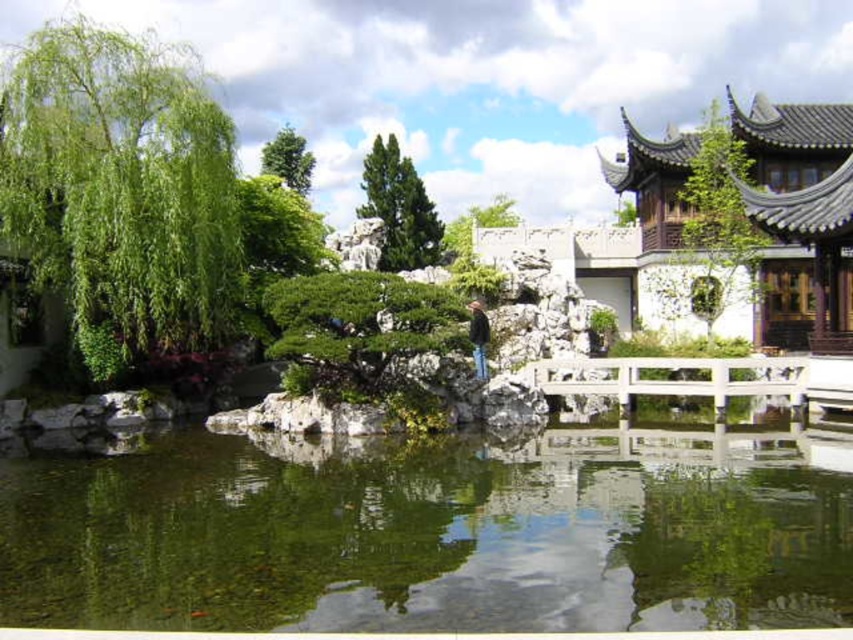
Who is shorter, green leafy tree at upper center or green leafy tree at center?

With less height is green leafy tree at upper center.

Who is more distant from viewer, (x=285, y=138) or (x=502, y=211)?

The point (x=285, y=138) is behind.

This screenshot has width=853, height=640. What are the coordinates of `green leafy tree at upper center` in the screenshot? It's located at (288, 160).

Between clear water at center and green leafy tree at upper center, which one appears on the left side from the viewer's perspective?

green leafy tree at upper center is more to the left.

Can you confirm if clear water at center is smaller than green leafy tree at upper center?

Yes, clear water at center is smaller than green leafy tree at upper center.

What do you see at coordinates (434, 536) in the screenshot? I see `clear water at center` at bounding box center [434, 536].

The image size is (853, 640). What are the coordinates of `clear water at center` in the screenshot? It's located at (434, 536).

This screenshot has height=640, width=853. Describe the element at coordinates (399, 208) in the screenshot. I see `green textured tree at center` at that location.

Does green textured tree at center appear over green leafy tree at upper center?

No.

Is point (386, 152) farther from camera compared to point (288, 132)?

No, it is in front of (288, 132).

Find the location of a particular element. The image size is (853, 640). green textured tree at center is located at coordinates (399, 208).